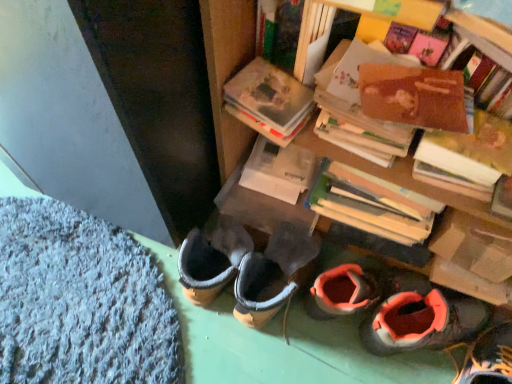
Describe the element at coordinates (132, 315) in the screenshot. The image size is (512, 384). I see `blue carpet at lower left` at that location.

Describe the element at coordinates (467, 157) in the screenshot. I see `brown cardboard book at upper right, the 2th book when ordered from left to right` at that location.

The width and height of the screenshot is (512, 384). I want to click on orange suede shoes at lower right, acting as the 2th footwear starting from the right, so click(x=422, y=322).

Image resolution: width=512 pixels, height=384 pixels. Describe the element at coordinates (352, 11) in the screenshot. I see `wooden bookshelf at upper right` at that location.

Where is `wooden bookshelf at upper right`? This screenshot has height=384, width=512. wooden bookshelf at upper right is located at coordinates (352, 11).

This screenshot has width=512, height=384. Find the location of `hardcover book at upper center, the 2th book from the right`. hardcover book at upper center, the 2th book from the right is located at coordinates (269, 101).

Measure the distance between hardcover book at upper center, the 1th book from the left, and camera.

The depth of hardcover book at upper center, the 1th book from the left, is 29.39 inches.

Where is `white matte book at center`? This screenshot has width=512, height=384. white matte book at center is located at coordinates (278, 170).

From the image's perspective, is orange suede boot at lower right, positioned as the 1th footwear in right-to-left order, located above or below hardcover book at upper center, the 1th book from the left?

Based on their image positions, orange suede boot at lower right, positioned as the 1th footwear in right-to-left order, is located beneath hardcover book at upper center, the 1th book from the left.

From a real-world perspective, is orange suede boot at lower right, positioned as the 1th footwear in right-to-left order, positioned over hardcover book at upper center, the 2th book from the right, based on gravity?

No.

Considering the relative sizes of orange suede boot at lower right, positioned as the 1th footwear in right-to-left order, and hardcover book at upper center, the 2th book from the right, in the image provided, is orange suede boot at lower right, positioned as the 1th footwear in right-to-left order, shorter than hardcover book at upper center, the 2th book from the right,?

No.

From the picture: Considering the relative positions of blue carpet at lower left and brown cardboard book at upper right, marked as the first book in a right-to-left arrangement, in the image provided, is blue carpet at lower left to the right of brown cardboard book at upper right, marked as the first book in a right-to-left arrangement, from the viewer's perspective?

Incorrect, blue carpet at lower left is not on the right side of brown cardboard book at upper right, marked as the first book in a right-to-left arrangement.

Which object is closer to the camera taking this photo, blue carpet at lower left or brown cardboard book at upper right, the 2th book when ordered from left to right?

brown cardboard book at upper right, the 2th book when ordered from left to right, is in front.

Are blue carpet at lower left and brown cardboard book at upper right, marked as the first book in a right-to-left arrangement, far apart?

That's not correct — blue carpet at lower left is a little close to brown cardboard book at upper right, marked as the first book in a right-to-left arrangement.

Is blue carpet at lower left inside or outside of brown cardboard book at upper right, the 2th book when ordered from left to right?

blue carpet at lower left is located beyond the bounds of brown cardboard book at upper right, the 2th book when ordered from left to right.

Who is taller, wooden bookshelf at upper right or orange suede boot at lower right, positioned as the 1th footwear in right-to-left order?

Standing taller between the two is wooden bookshelf at upper right.

Image resolution: width=512 pixels, height=384 pixels. In the image, there is a orange suede boot at lower right, positioned as the 1th footwear in right-to-left order. Identify the location of shelf above it (from the image's perspective). (352, 11).

How many degrees apart are the facing directions of wooden bookshelf at upper right and orange suede boot at lower right, the 2th footwear positioned from the left?

The angular difference between wooden bookshelf at upper right and orange suede boot at lower right, the 2th footwear positioned from the left, is 154 degrees.

Is wooden bookshelf at upper right touching orange suede boot at lower right, the 2th footwear positioned from the left?

No, wooden bookshelf at upper right is not with orange suede boot at lower right, the 2th footwear positioned from the left.

Can you confirm if white matte book at center is shorter than orange suede shoes at lower right, the 1th footwear in the left-to-right sequence?

Indeed, white matte book at center has a lesser height compared to orange suede shoes at lower right, the 1th footwear in the left-to-right sequence.

From a real-world perspective, is white matte book at center physically located above or below orange suede shoes at lower right, the 1th footwear in the left-to-right sequence?

In terms of real-world spatial position, white matte book at center is above orange suede shoes at lower right, the 1th footwear in the left-to-right sequence.

Is white matte book at center thinner than orange suede shoes at lower right, the 1th footwear in the left-to-right sequence?

Yes, white matte book at center is thinner than orange suede shoes at lower right, the 1th footwear in the left-to-right sequence.

From the image's perspective, would you say white matte book at center is shown under orange suede shoes at lower right, acting as the 2th footwear starting from the right?

Actually, white matte book at center appears above orange suede shoes at lower right, acting as the 2th footwear starting from the right, in the image.

Who is bigger, orange suede shoes at lower right, acting as the 2th footwear starting from the right, or blue carpet at lower left?

blue carpet at lower left is bigger.

How far apart are orange suede shoes at lower right, the 1th footwear in the left-to-right sequence, and blue carpet at lower left?

A distance of 13.31 inches exists between orange suede shoes at lower right, the 1th footwear in the left-to-right sequence, and blue carpet at lower left.

The height and width of the screenshot is (384, 512). Find the location of `carpets on the left of orange suede shoes at lower right, the 1th footwear in the left-to-right sequence`. carpets on the left of orange suede shoes at lower right, the 1th footwear in the left-to-right sequence is located at coordinates (132, 315).

Which is correct: brown cardboard book at upper right, the 2th book when ordered from left to right, is inside orange suede shoes at lower right, acting as the 2th footwear starting from the right, or outside of it?

brown cardboard book at upper right, the 2th book when ordered from left to right, is outside orange suede shoes at lower right, acting as the 2th footwear starting from the right.

Considering the sizes of objects brown cardboard book at upper right, the 2th book when ordered from left to right, and orange suede shoes at lower right, the 1th footwear in the left-to-right sequence, in the image provided, who is bigger, brown cardboard book at upper right, the 2th book when ordered from left to right, or orange suede shoes at lower right, the 1th footwear in the left-to-right sequence,?

orange suede shoes at lower right, the 1th footwear in the left-to-right sequence, is bigger.

There is a brown cardboard book at upper right, the 2th book when ordered from left to right. What are the coordinates of `the 1st footwear below it (from the image's perspective)` in the screenshot? It's located at (422, 322).

Which is more to the right, brown cardboard book at upper right, marked as the first book in a right-to-left arrangement, or orange suede shoes at lower right, acting as the 2th footwear starting from the right?

orange suede shoes at lower right, acting as the 2th footwear starting from the right, is more to the right.

Is blue carpet at lower left outside of blue textured mat at lower left?

That's correct, blue carpet at lower left is outside of blue textured mat at lower left.

Is blue carpet at lower left facing towards blue textured mat at lower left?

No, blue carpet at lower left is not facing towards blue textured mat at lower left.

From the image's perspective, which one is positioned higher, blue carpet at lower left or blue textured mat at lower left?

blue carpet at lower left is shown above in the image.

In the image, is blue carpet at lower left on the left side or the right side of blue textured mat at lower left?

Based on their positions, blue carpet at lower left is located to the right of blue textured mat at lower left.

From the image's perspective, which book is the 2nd one above the orange suede boot at lower right, positioned as the 1th footwear in right-to-left order? Please provide its 2D coordinates.

[(269, 101)]

You are a GUI agent. You are given a task and a screenshot of the screen. Output one action in this format:
    pyautogui.click(x=<x>, y=<y>)
    Task: Click on the 2nd book in front of the blue carpet at lower left
    This screenshot has width=512, height=384.
    Given the screenshot: What is the action you would take?
    pyautogui.click(x=467, y=157)

Estimate the real-world distances between objects in this image. Which object is further from orange suede shoes at lower right, acting as the 2th footwear starting from the right, wooden bookshelf at upper right or orange suede boot at lower right, the 2th footwear positioned from the left?

Among the two, wooden bookshelf at upper right is located further to orange suede shoes at lower right, acting as the 2th footwear starting from the right.

Looking at the image, which one is located further to white matte book at center, blue carpet at lower left or orange suede boot at lower right, the 2th footwear positioned from the left?

orange suede boot at lower right, the 2th footwear positioned from the left, is positioned further to the anchor white matte book at center.

When comparing their distances from white matte book at center, does orange suede shoes at lower right, acting as the 2th footwear starting from the right, or orange suede boot at lower right, positioned as the 1th footwear in right-to-left order, seem closer?

The object closer to white matte book at center is orange suede shoes at lower right, acting as the 2th footwear starting from the right.

Looking at the image, which one is located closer to brown cardboard book at upper right, marked as the first book in a right-to-left arrangement, white matte book at center or orange suede boot at lower right, positioned as the 1th footwear in right-to-left order?

Based on the image, white matte book at center appears to be nearer to brown cardboard book at upper right, marked as the first book in a right-to-left arrangement.

Based on their spatial positions, is brown cardboard book at upper right, the 2th book when ordered from left to right, or blue textured mat at lower left further from white matte book at center?

blue textured mat at lower left is positioned further to the anchor white matte book at center.

Which object lies nearer to the anchor point wooden bookshelf at upper right, white matte book at center or brown cardboard book at upper right, marked as the first book in a right-to-left arrangement?

Among the two, brown cardboard book at upper right, marked as the first book in a right-to-left arrangement, is located nearer to wooden bookshelf at upper right.

Estimate the real-world distances between objects in this image. Which object is further from brown cardboard book at upper right, the 2th book when ordered from left to right, orange suede shoes at lower right, the 1th footwear in the left-to-right sequence, or blue carpet at lower left?

The object further to brown cardboard book at upper right, the 2th book when ordered from left to right, is blue carpet at lower left.

Which object lies further to the anchor point orange suede shoes at lower right, acting as the 2th footwear starting from the right, blue textured mat at lower left or white matte book at center?

blue textured mat at lower left is positioned further to the anchor orange suede shoes at lower right, acting as the 2th footwear starting from the right.

You are a GUI agent. You are given a task and a screenshot of the screen. Output one action in this format:
    pyautogui.click(x=<x>, y=<y>)
    Task: Click on the carpets between blue textured mat at lower left and white matte book at center
    The image size is (512, 384).
    Given the screenshot: What is the action you would take?
    pyautogui.click(x=132, y=315)

What are the coordinates of `carpets between wooden bookshelf at upper right and orange suede boot at lower right, positioned as the 1th footwear in right-to-left order, in the up-down direction` in the screenshot? It's located at (132, 315).

The width and height of the screenshot is (512, 384). What are the coordinates of `paperback book situated between blue textured mat at lower left and wooden bookshelf at upper right from left to right` in the screenshot? It's located at (278, 170).

Identify the location of footwear between wooden bookshelf at upper right and orange suede boot at lower right, the 2th footwear positioned from the left, vertically. (422, 322).